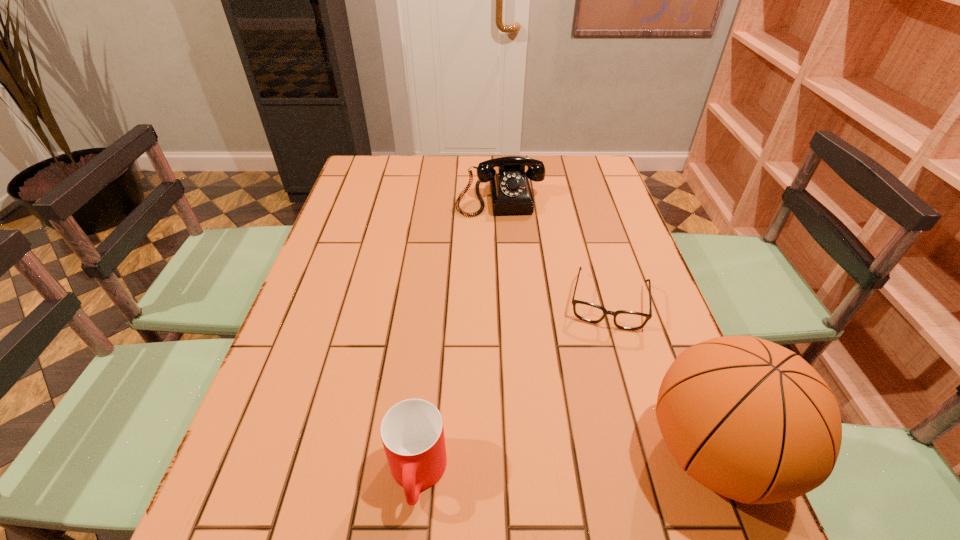
I want to click on vacant spot on the desktop that is between the cup and the basketball and is positioned on the dial of the farthest object, so click(x=540, y=465).

The height and width of the screenshot is (540, 960). Identify the location of vacant space on the desktop that is between the cup and the tallest object and is positioned on the front-facing side of the second farthest object. (591, 462).